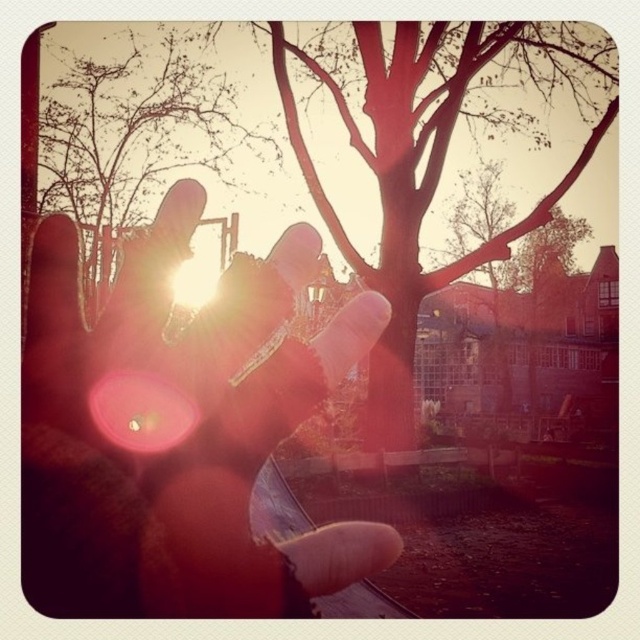
Is translucent skin at center positioned before smooth bark tree at center?

Yes.

Find the location of a particular element. translucent skin at center is located at coordinates (177, 429).

Between translucent skin at center and brown matte tree at upper center, which one has less height?

Standing shorter between the two is translucent skin at center.

Between translucent skin at center and brown matte tree at upper center, which one appears on the left side from the viewer's perspective?

brown matte tree at upper center

You are a GUI agent. You are given a task and a screenshot of the screen. Output one action in this format:
    pyautogui.click(x=<x>, y=<y>)
    Task: Click on the translucent skin at center
    
    Given the screenshot: What is the action you would take?
    pyautogui.click(x=177, y=429)

Can you confirm if smooth bark tree at center is thinner than brown matte tree at upper center?

Yes, smooth bark tree at center is thinner than brown matte tree at upper center.

Who is positioned more to the right, smooth bark tree at center or brown matte tree at upper center?

smooth bark tree at center

Is point (403, 435) farther from viewer compared to point (67, 67)?

No, (403, 435) is closer to viewer.

Identify the location of smooth bark tree at center. (406, 188).